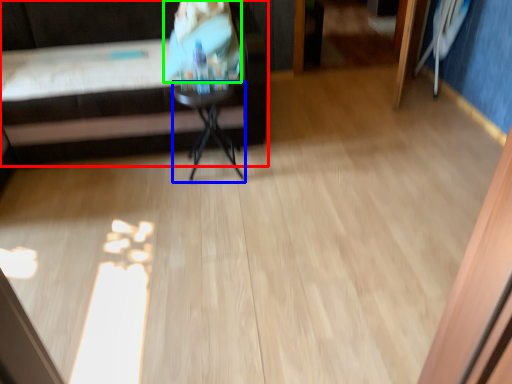
Question: Considering the real-world distances, which object is closest to furniture (highlighted by a red box)? side table (highlighted by a blue box) or person (highlighted by a green box).

Choices:
 (A) side table
 (B) person

Answer: (A)